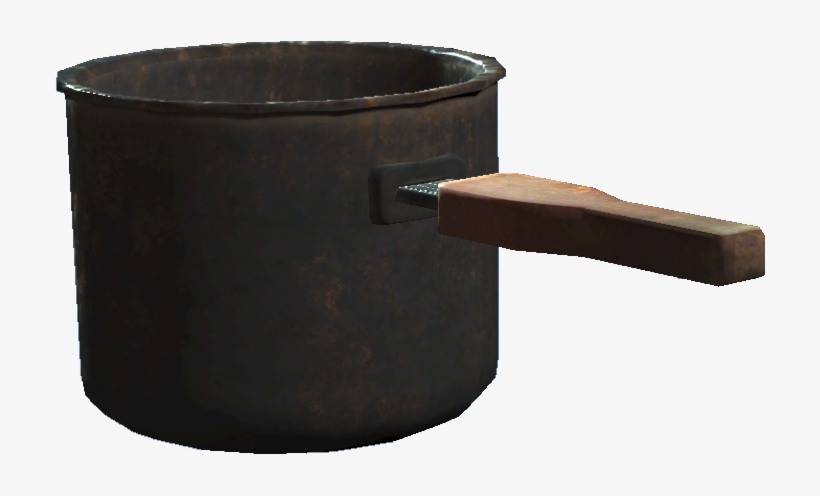
The width and height of the screenshot is (820, 496). I want to click on handle, so click(x=508, y=226).